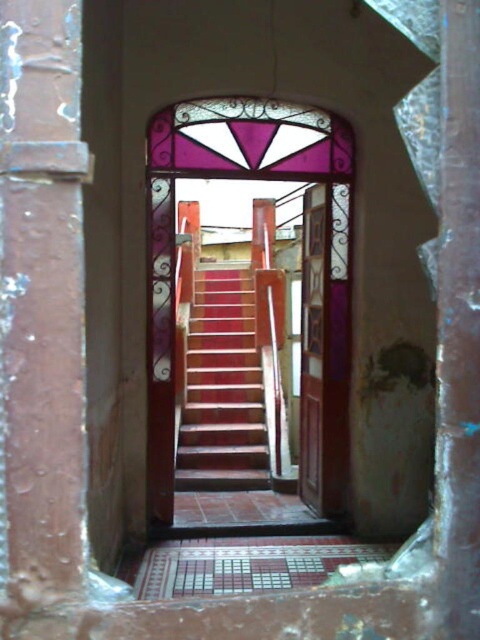
You are a delivery person carrying a large box that is 15 feet long. You need to navigate through the narrow passageway between the translucent stained glass at center and the smooth concrete pillar at right. Can you fit through the space between them?

The distance between the translucent stained glass at center and the smooth concrete pillar at right is 13.66 feet. Since your box is 15 feet long, it is longer than the available space, so you cannot fit through the space between them.

You are an architect assessing the structural integrity of the passageway. The translucent stained glass at center and the smooth concrete pillar at right are key elements. Based on their sizes, which one might require additional support to prevent collapse?

The translucent stained glass at center is taller than the smooth concrete pillar at right, so it might require additional support to prevent collapse due to its greater height potentially affecting structural stability.

You are standing in the passageway and want to open the wooden door at center. However, there is a rusty metal pillar at left blocking your path. Can you walk around it to reach the door?

The rusty metal pillar at left is above the wooden door at center, so the pillar is positioned higher up and does not block the path. You can walk around it to reach the wooden door at center.